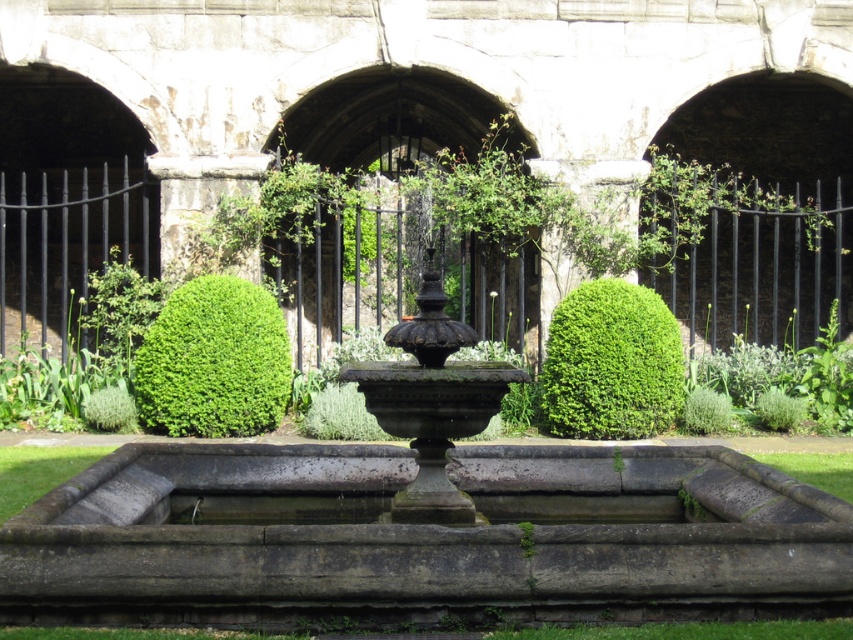
Question: Which of the following is the farthest from the observer?

Choices:
 (A) (233, 412)
 (B) (569, 342)

Answer: (B)

Question: Considering the relative positions of green leafy bush at left and green leafy bush at center in the image provided, where is green leafy bush at left located with respect to green leafy bush at center?

Choices:
 (A) right
 (B) left

Answer: (B)

Question: Can you confirm if green leafy bush at left is positioned above green leafy bush at center?

Choices:
 (A) no
 (B) yes

Answer: (B)

Question: Which object appears farthest from the camera in this image?

Choices:
 (A) green leafy bush at center
 (B) green leafy bush at left

Answer: (B)

Question: Does green leafy bush at left have a larger size compared to green leafy bush at center?

Choices:
 (A) no
 (B) yes

Answer: (B)

Question: Which point is farther from the camera taking this photo?

Choices:
 (A) (280, 394)
 (B) (677, 362)

Answer: (A)